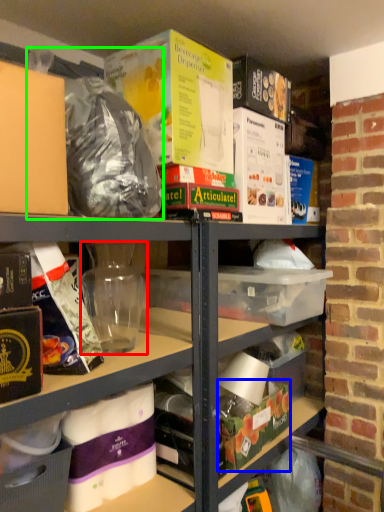
Question: Considering the real-world distances, which object is closest to yoghurt (highlighted by a red box)? storage box (highlighted by a blue box) or garbage (highlighted by a green box).

Choices:
 (A) storage box
 (B) garbage

Answer: (B)